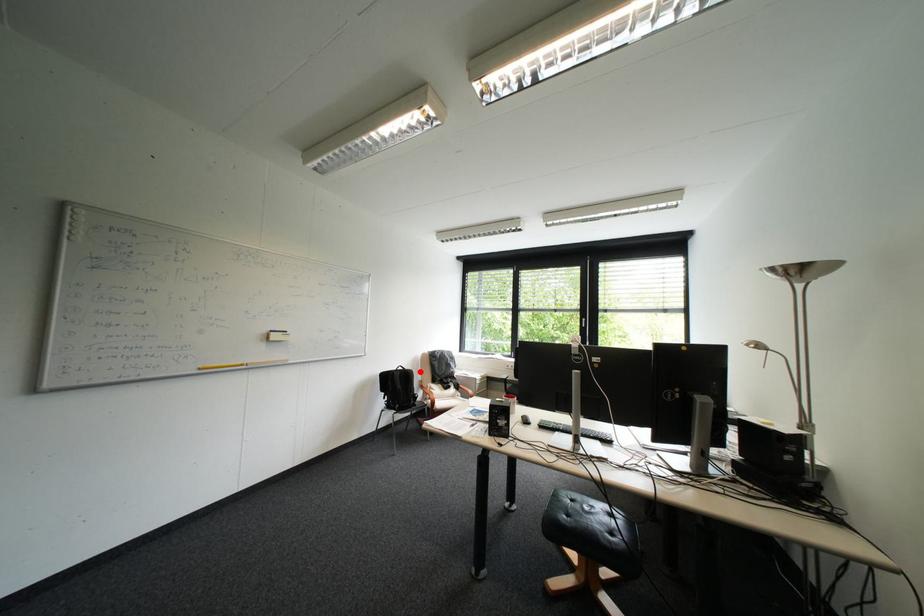
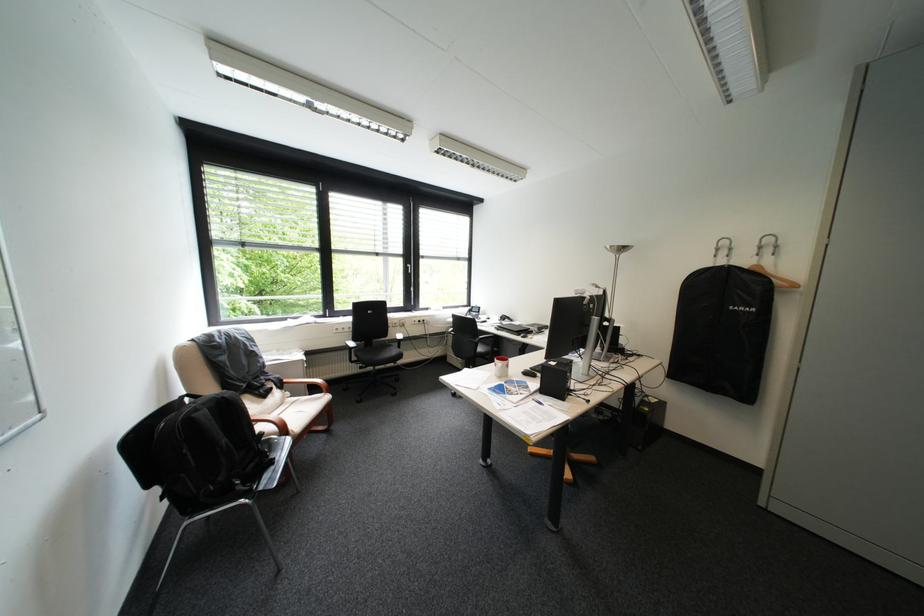
Question: I am providing you with two images of the same scene from different viewpoints. A red point is shown in image1. For the corresponding object point in image2, is it positioned nearer or farther from the camera?

Choices:
 (A) Nearer
 (B) Farther

Answer: (A)